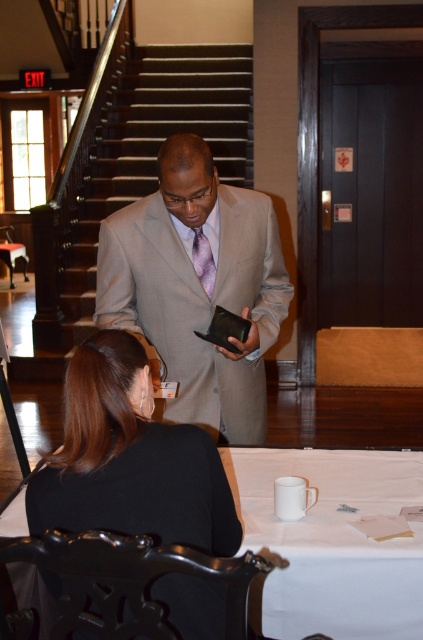
Question: In this image, where is white matte table at center located relative to white matte table at lower center?

Choices:
 (A) right
 (B) left

Answer: (A)

Question: Does light beige suit at center have a lesser width compared to white matte table at center?

Choices:
 (A) yes
 (B) no

Answer: (B)

Question: Which object is positioned farthest from the black fabric jacket at lower left?

Choices:
 (A) white matte table at center
 (B) white matte table at lower center
 (C) purple satin tie at center

Answer: (C)

Question: Which point appears closest to the camera in this image?

Choices:
 (A) (415, 586)
 (B) (419, 592)
 (C) (187, 484)

Answer: (C)

Question: Can you confirm if light beige suit at center is thinner than white matte table at center?

Choices:
 (A) yes
 (B) no

Answer: (B)

Question: Which of the following is the closest to the observer?

Choices:
 (A) white matte table at lower center
 (B) white matte table at center
 (C) light beige suit at center
 (D) black fabric jacket at lower left

Answer: (D)